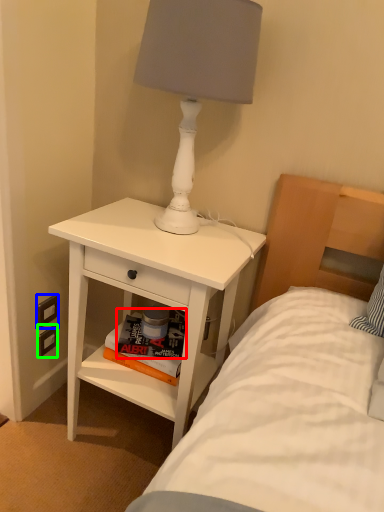
Question: Considering the real-world distances, which object is farthest from magazine (highlighted by a red box)? electric outlet (highlighted by a blue box) or electric outlet (highlighted by a green box)?

Choices:
 (A) electric outlet
 (B) electric outlet

Answer: (B)